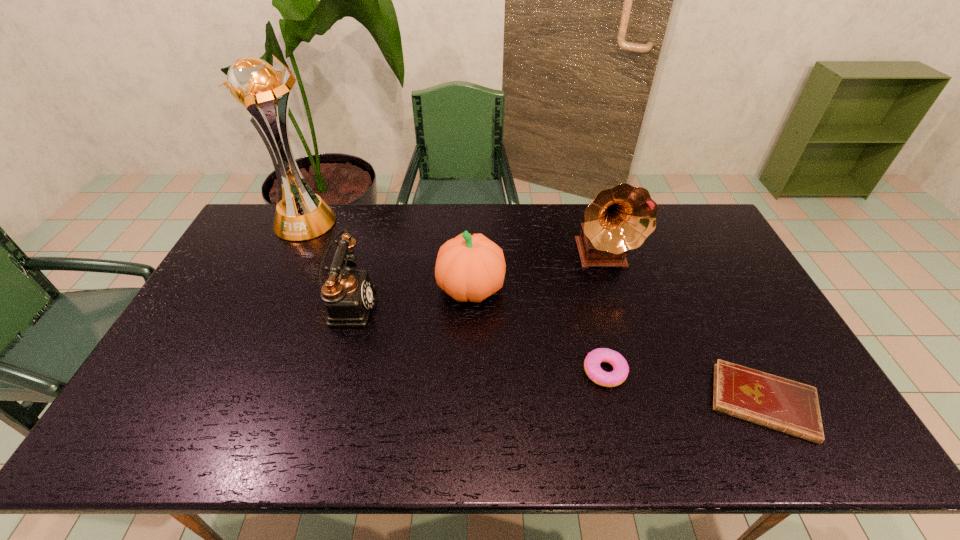
Image resolution: width=960 pixels, height=540 pixels. What are the coordinates of `free point between the tallest object and the shortest object` in the screenshot? It's located at (534, 312).

Locate which object is the fifth closest to the phonograph_record. Please provide its 2D coordinates. Your answer should be formatted as a tuple, i.e. [(x, y)], where the tuple contains the x and y coordinates of a point satisfying the conditions above.

[(254, 85)]

Identify which object is the fourth nearest to the second object from left to right. Please provide its 2D coordinates. Your answer should be formatted as a tuple, i.e. [(x, y)], where the tuple contains the x and y coordinates of a point satisfying the conditions above.

[(619, 219)]

The image size is (960, 540). I want to click on free location that satisfies the following two spatial constraints: 1. on the front-facing side of the leftmost object; 2. on the left side of the rightmost object, so click(220, 402).

Where is `vacant space that satisfies the following two spatial constraints: 1. on the front of the second object from left to right at the rotary dial; 2. on the right side of the shortest object`? Image resolution: width=960 pixels, height=540 pixels. vacant space that satisfies the following two spatial constraints: 1. on the front of the second object from left to right at the rotary dial; 2. on the right side of the shortest object is located at coordinates (320, 402).

The height and width of the screenshot is (540, 960). What are the coordinates of `free space that satisfies the following two spatial constraints: 1. on the front-facing side of the third object from left to right; 2. on the left side of the leftmost object` in the screenshot? It's located at (273, 288).

Where is `vacant area that satisfies the following two spatial constraints: 1. on the front side of the doughnut; 2. on the left side of the fourth object from right to left`? vacant area that satisfies the following two spatial constraints: 1. on the front side of the doughnut; 2. on the left side of the fourth object from right to left is located at coordinates (469, 372).

At what (x,y) coordinates should I click in order to perform the action: click on free spot that satisfies the following two spatial constraints: 1. on the back side of the second shortest object; 2. on the front of the telephone at the rotary dial. Please return your answer as a coordinate pair (x, y). Image resolution: width=960 pixels, height=540 pixels. Looking at the image, I should click on (588, 305).

In order to click on vacant space that satisfies the following two spatial constraints: 1. on the front side of the third object from left to right; 2. on the right side of the shortest object in this screenshot , I will do `click(468, 402)`.